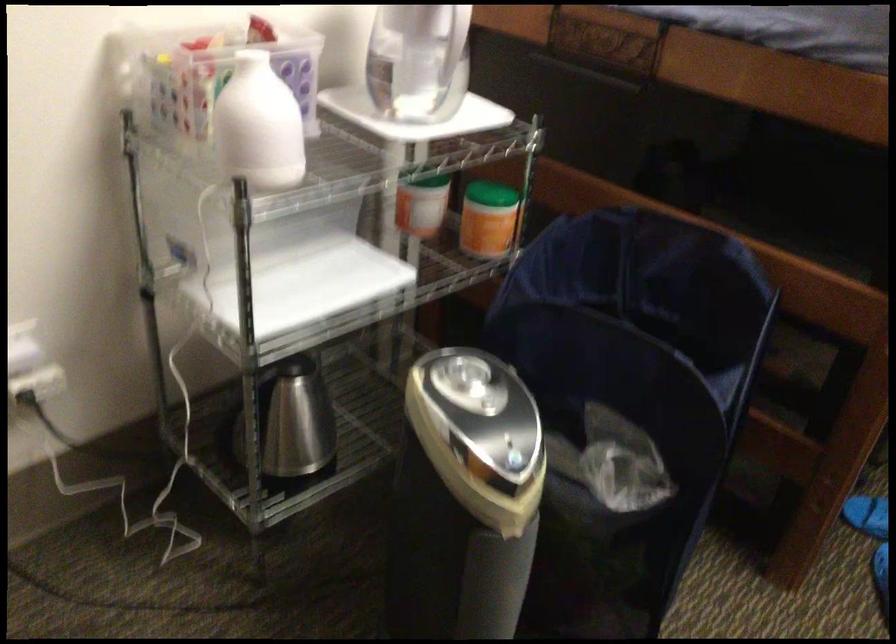
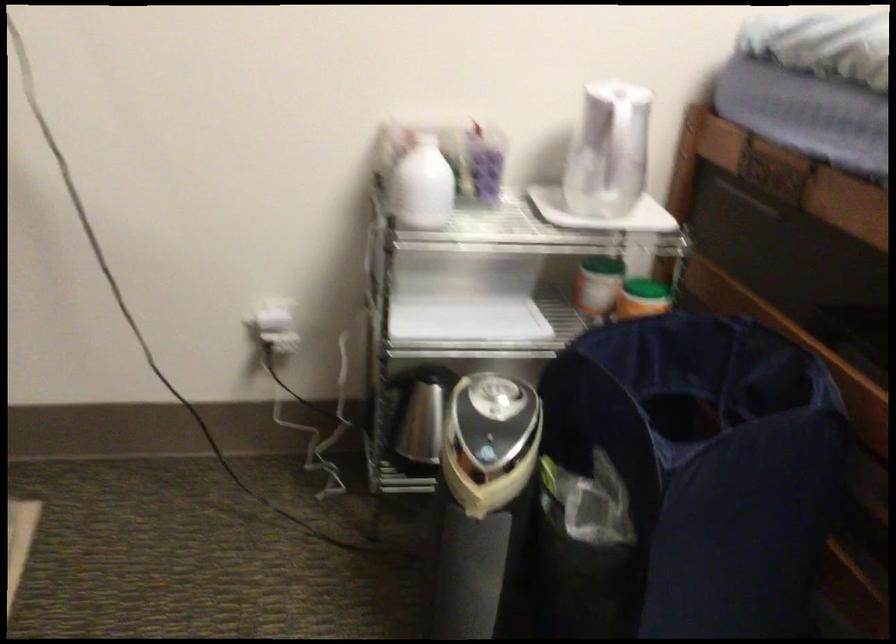
Locate, in the second image, the point that corresponds to (x=277, y=131) in the first image.

(421, 185)